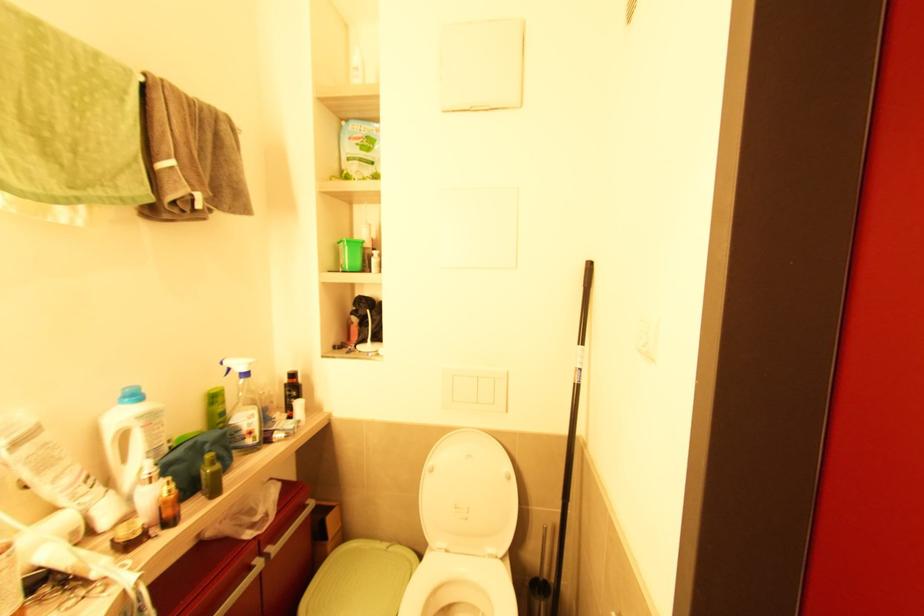
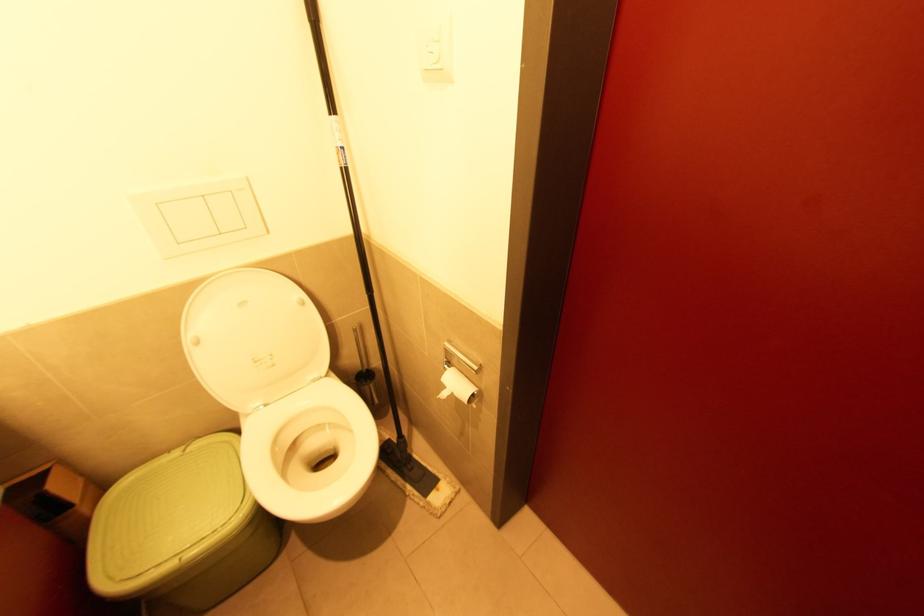
In the second image, find the point that corresponds to (432,472) in the first image.

(200, 342)